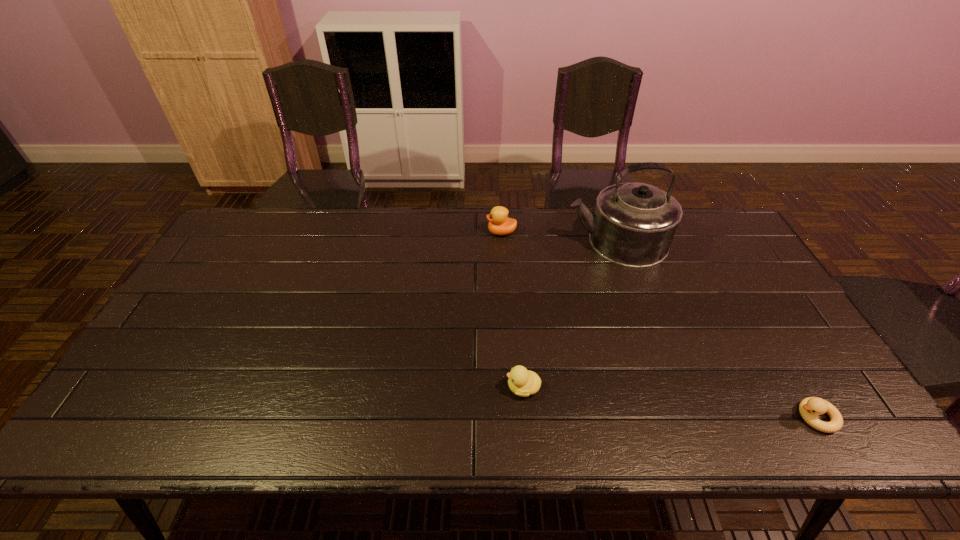
Locate which object is the closest to the rightmost object. Please provide its 2D coordinates. Your answer should be formatted as a tuple, i.e. [(x, y)], where the tuple contains the x and y coordinates of a point satisfying the conditions above.

[(633, 225)]

At what (x,y) coordinates should I click in order to perform the action: click on duckling that stands as the closest to the second tallest object. Please return your answer as a coordinate pair (x, y). The image size is (960, 540). Looking at the image, I should click on (522, 382).

Locate an element on the screen. the closest duckling to the farthest duckling is located at coordinates (522, 382).